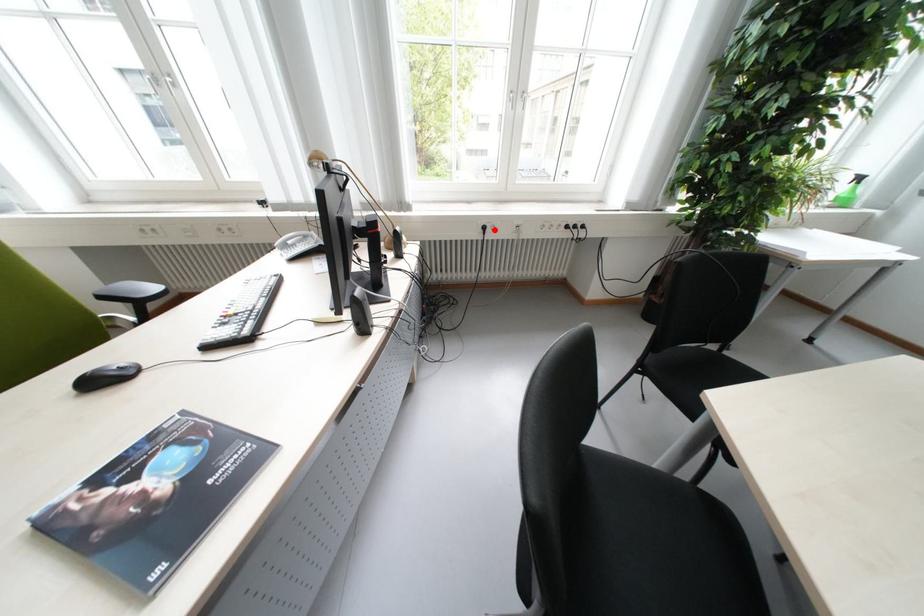
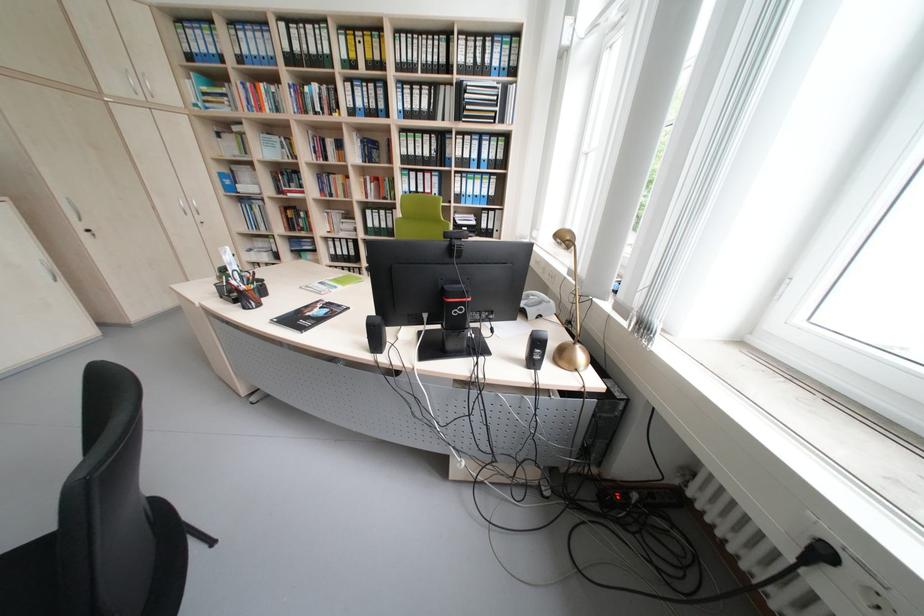
Find the pixel in the second image that matches the highlighted location in the first image.

(833, 554)